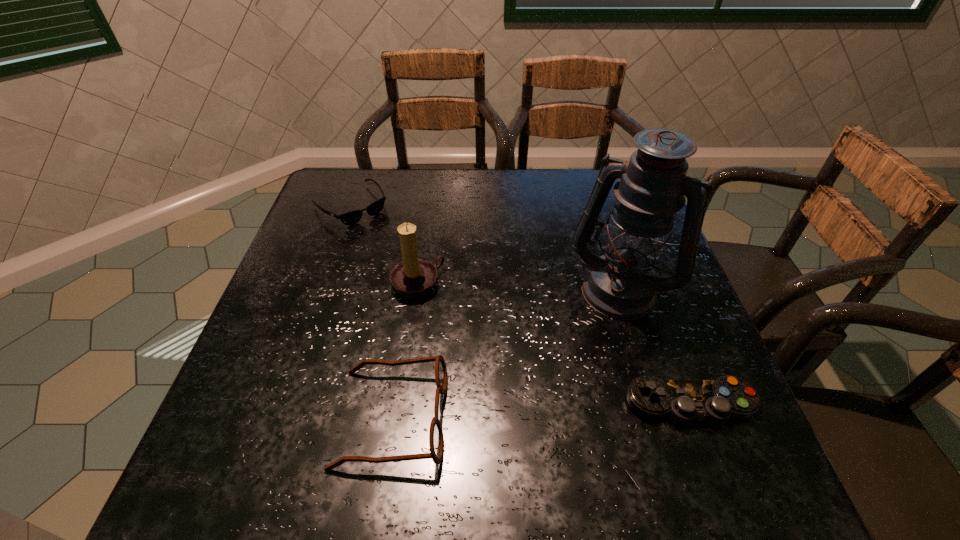
The image size is (960, 540). I want to click on the third tallest object, so click(436, 439).

Locate an element on the screen. control is located at coordinates (682, 401).

Where is `the tallest object`? This screenshot has height=540, width=960. the tallest object is located at coordinates (621, 284).

Find the location of a particular element. The image size is (960, 540). the fourth shortest object is located at coordinates (413, 278).

Identify the location of sunglasses. (352, 217).

Where is `the leftmost object`? The image size is (960, 540). the leftmost object is located at coordinates (352, 217).

Image resolution: width=960 pixels, height=540 pixels. In order to click on free space located on the front-facing side of the third shortest object in this screenshot , I will do `click(605, 417)`.

What are the coordinates of `vacant space located 0.350m on the left of the control` in the screenshot? It's located at (439, 405).

Identify the location of vacant space located 0.190m on the front-facing side of the tallest object. (572, 382).

Find the location of a particular element. vacant space positioned 0.070m on the front-facing side of the tallest object is located at coordinates (592, 339).